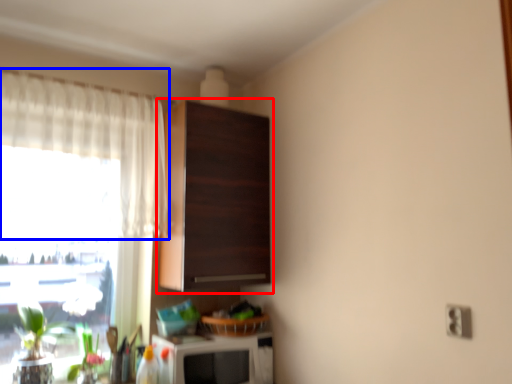
Question: Which point is closer to the camera, cabinetry (highlighted by a red box) or curtain (highlighted by a blue box)?

Choices:
 (A) cabinetry
 (B) curtain

Answer: (B)